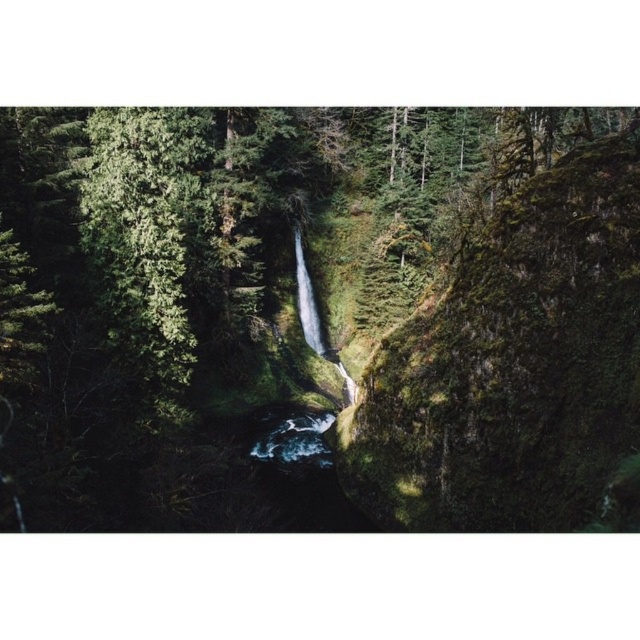
Is point (621, 448) closer to camera compared to point (296, 262)?

Yes, it is in front of point (296, 262).

Which of these two, green mossy rock at center or clear water at center, stands taller?

With more height is green mossy rock at center.

What do you see at coordinates (321, 310) in the screenshot? This screenshot has height=640, width=640. I see `green mossy rock at center` at bounding box center [321, 310].

Locate an element on the screen. The width and height of the screenshot is (640, 640). green mossy rock at center is located at coordinates (321, 310).